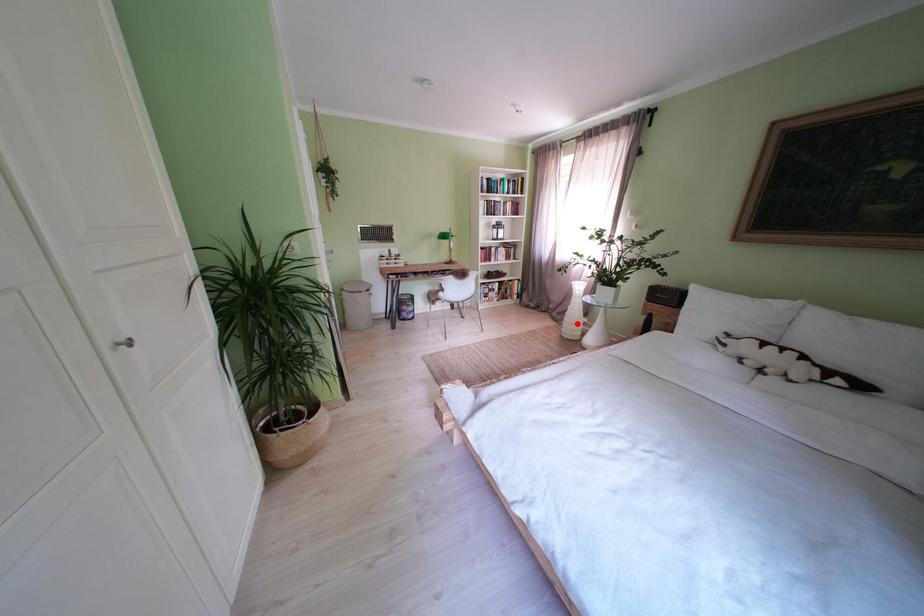
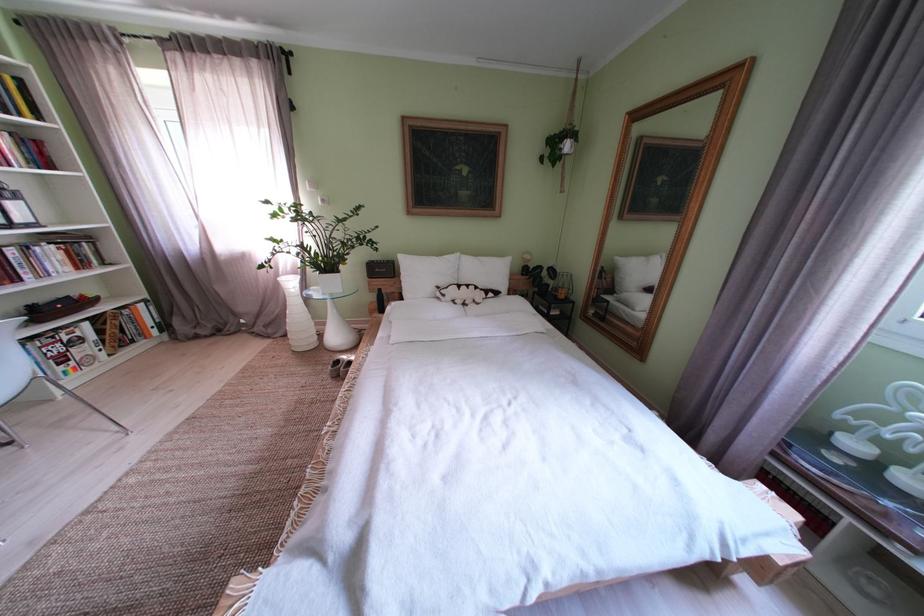
Question: I am providing you with two images of the same scene from different viewpoints. In image1, a red point is highlighted. Considering the same 3D point in image2, which of the following is correct?

Choices:
 (A) It is closer
 (B) It is farther

Answer: (B)